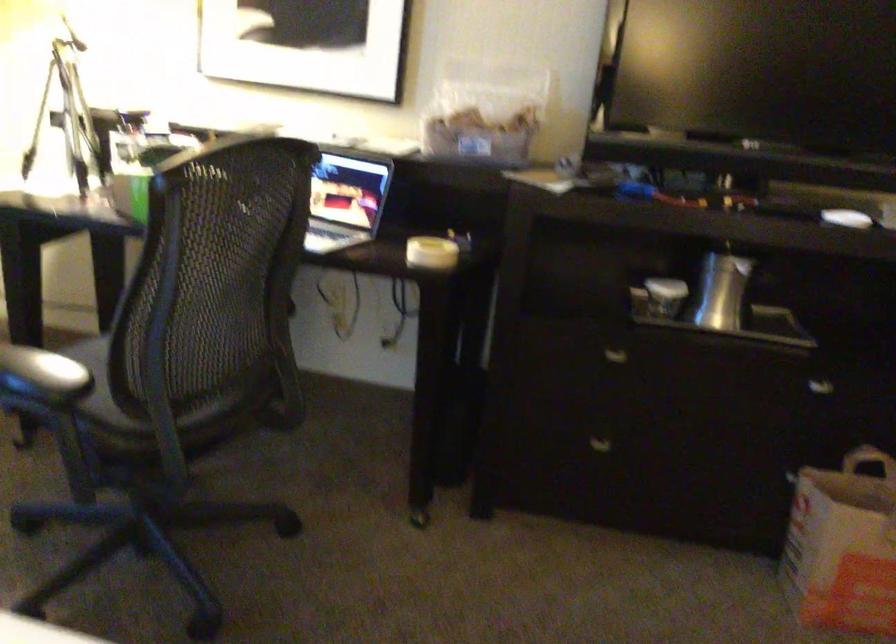
Where is `paper bag handle`? The image size is (896, 644). paper bag handle is located at coordinates (867, 460).